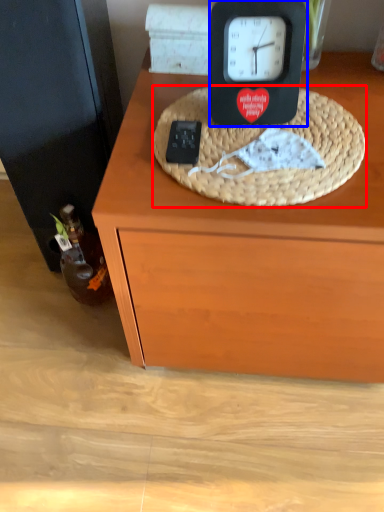
Question: Which point is further to the camera, basket (highlighted by a red box) or clock (highlighted by a blue box)?

Choices:
 (A) basket
 (B) clock

Answer: (B)